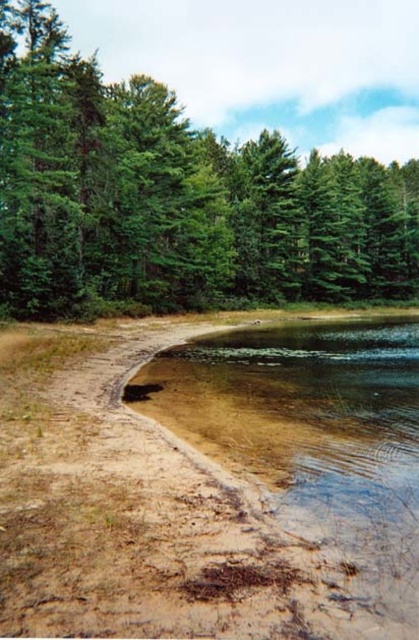
Question: Among these objects, which one is farthest from the camera?

Choices:
 (A) clear sedimentary sand at lower left
 (B) green leafy tree at upper left

Answer: (B)

Question: Which point appears closest to the camera in this image?

Choices:
 (A) (178, 284)
 (B) (349, 413)

Answer: (B)

Question: Is green leafy tree at upper left closer to the viewer compared to clear sedimentary sand at lower left?

Choices:
 (A) no
 (B) yes

Answer: (A)

Question: Is green leafy tree at upper left to the right of clear sedimentary sand at lower left from the viewer's perspective?

Choices:
 (A) no
 (B) yes

Answer: (B)

Question: Does green leafy tree at upper left appear under clear sedimentary sand at lower left?

Choices:
 (A) no
 (B) yes

Answer: (A)

Question: Which point appears farthest from the camera in this image?

Choices:
 (A) (369, 406)
 (B) (193, 132)

Answer: (B)